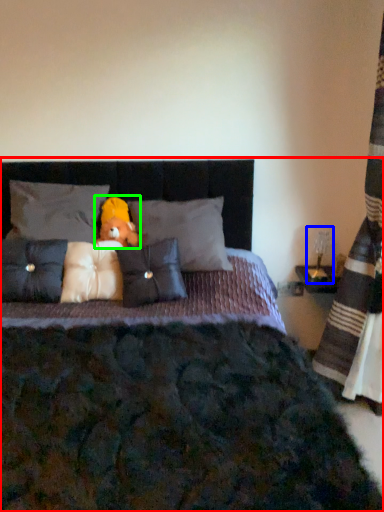
Question: Which object is the closest to the bed (highlighted by a red box)? Choose among these: table lamp (highlighted by a blue box) or toy (highlighted by a green box).

Choices:
 (A) table lamp
 (B) toy

Answer: (B)